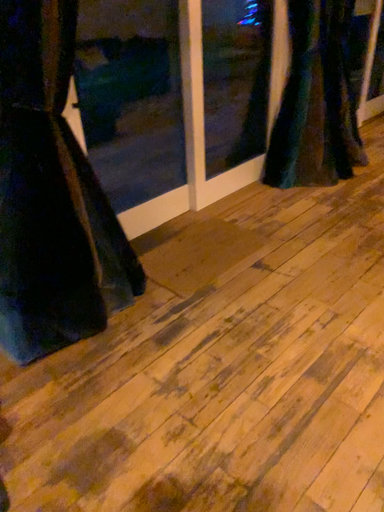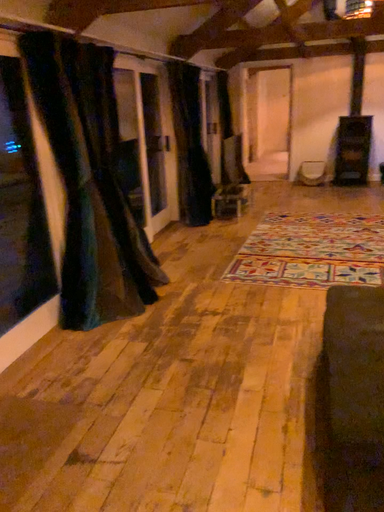
Question: Which way did the camera rotate in the video?

Choices:
 (A) rotated left
 (B) rotated right

Answer: (B)